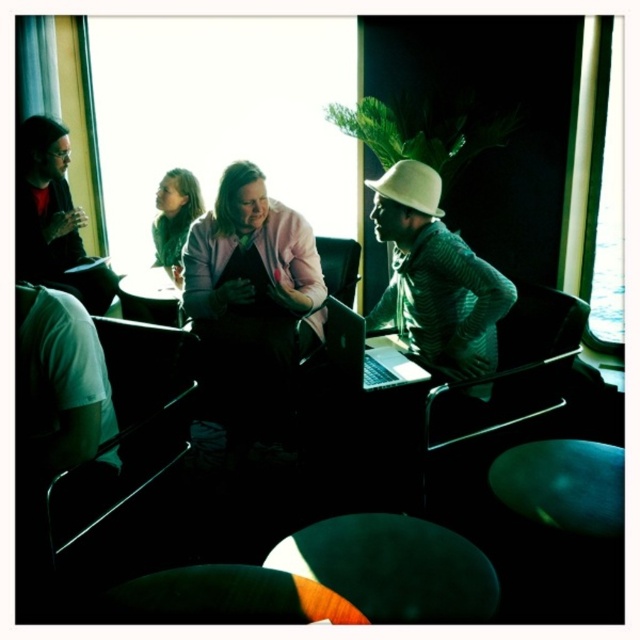
Question: Which point appears farthest from the camera in this image?

Choices:
 (A) (381, 548)
 (B) (232, 230)
 (C) (19, 150)
 (D) (148, 417)

Answer: (C)

Question: Observing the image, what is the correct spatial positioning of matte black jacket at left in reference to white matte hat at center?

Choices:
 (A) left
 (B) right

Answer: (A)

Question: In this image, where is matte pink sweater at center located relative to white matte hat at center?

Choices:
 (A) left
 (B) right

Answer: (A)

Question: Which point is farther from the camera taking this photo?

Choices:
 (A) (170, 285)
 (B) (148, 401)
 (C) (460, 593)
 (D) (156, 241)

Answer: (D)

Question: Which of the following is the closest to the observer?

Choices:
 (A) (563, 339)
 (B) (163, 216)
 (C) (422, 186)

Answer: (C)

Question: Is green knit sweater at center bigger than wooden round table at center?

Choices:
 (A) no
 (B) yes

Answer: (B)